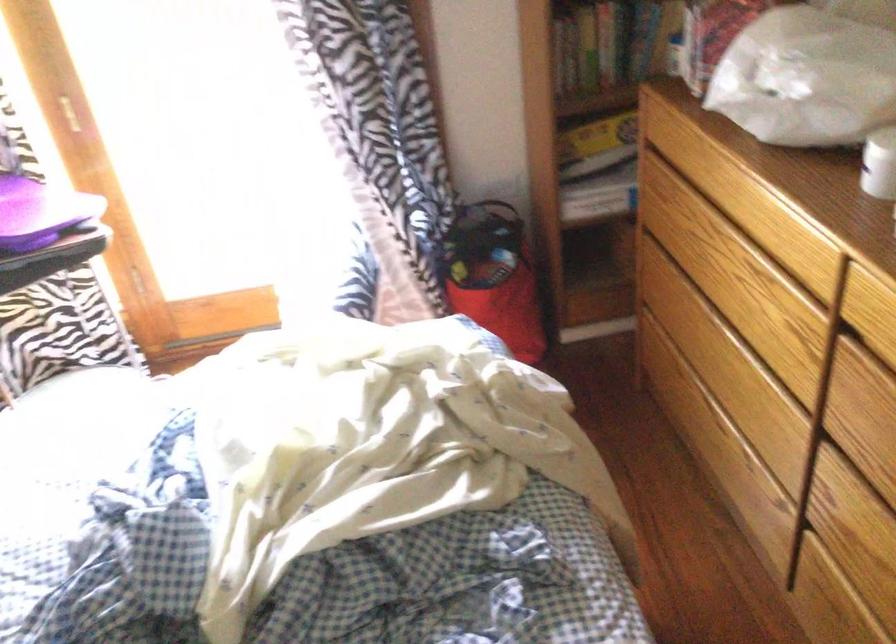
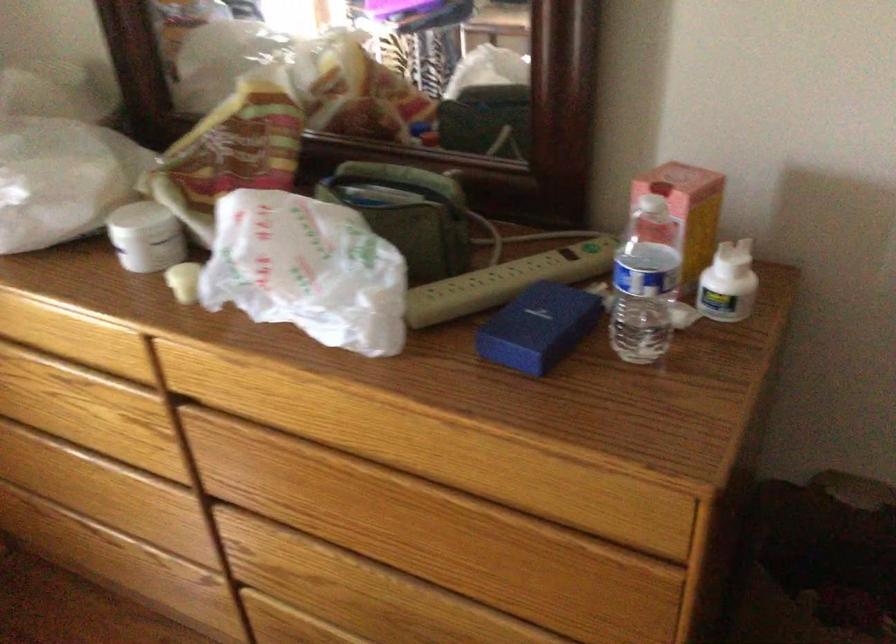
Question: The images are taken continuously from a first-person perspective. In which direction is your viewpoint rotating?

Choices:
 (A) Left
 (B) Right
 (C) Up
 (D) Down

Answer: (B)